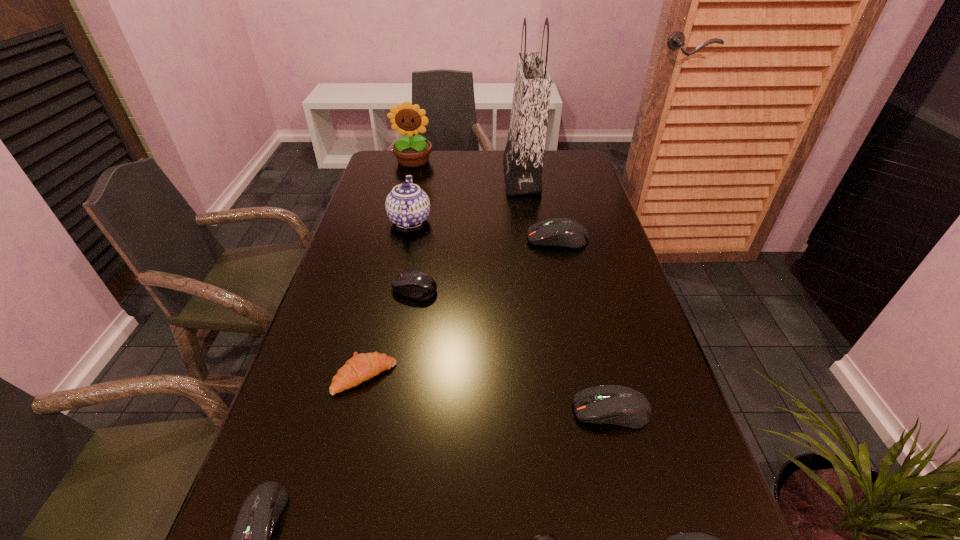
Identify which computer equipment is the fifth nearest to the third smallest dark computer equipment. Please provide its 2D coordinates. Your answer should be formatted as a tuple, i.e. [(x, y)], where the tuple contains the x and y coordinates of a point satisfying the conditions above.

[(260, 511)]

Locate an element on the screen. The width and height of the screenshot is (960, 540). the closest dark computer equipment to the leftmost dark computer equipment is located at coordinates (620, 405).

Identify which dark computer equipment is the third nearest to the third biggest dark computer equipment. Please provide its 2D coordinates. Your answer should be formatted as a tuple, i.e. [(x, y)], where the tuple contains the x and y coordinates of a point satisfying the conditions above.

[(562, 232)]

Where is `free location that satisfies the following two spatial constraints: 1. on the front of the shopping bag with the design; 2. on the front side of the second farthest computer equipment`? The height and width of the screenshot is (540, 960). free location that satisfies the following two spatial constraints: 1. on the front of the shopping bag with the design; 2. on the front side of the second farthest computer equipment is located at coordinates (538, 289).